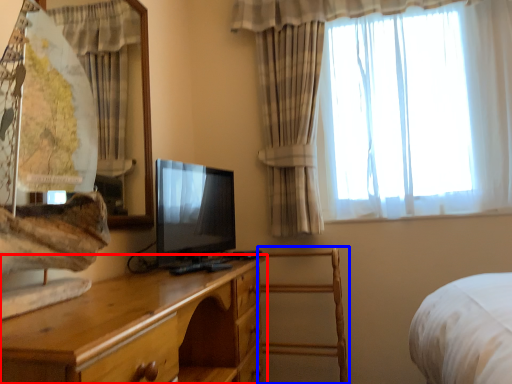
Question: Which point is further to the camera, chest of drawers (highlighted by a red box) or armchair (highlighted by a blue box)?

Choices:
 (A) chest of drawers
 (B) armchair

Answer: (B)